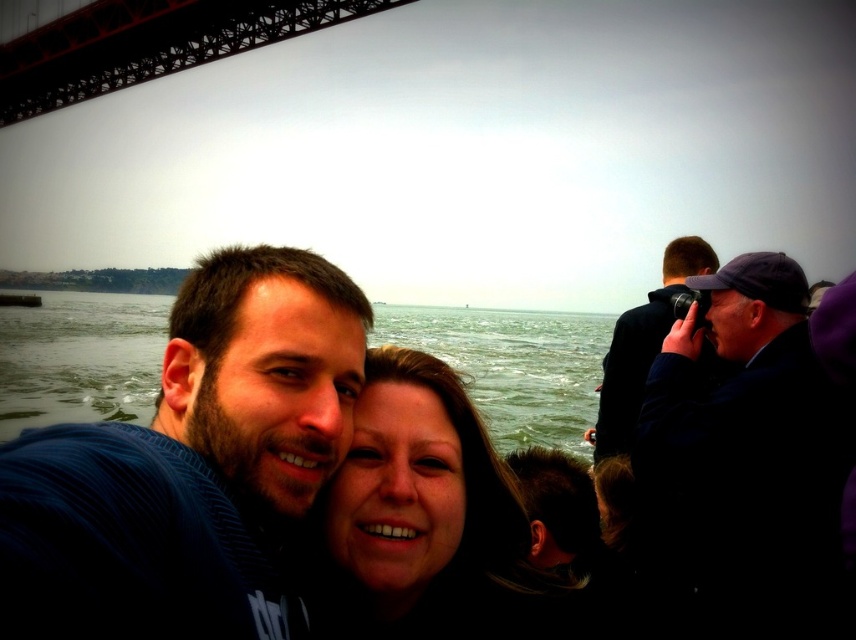
Question: Which is farther from the smooth skin face at center?

Choices:
 (A) green water at center
 (B) dark blue fabric at right
 (C) metallic bridge at upper left
 (D) dark blue striped shirt at center

Answer: (C)

Question: Can you confirm if green water at center is thinner than metallic bridge at upper left?

Choices:
 (A) yes
 (B) no

Answer: (B)

Question: From the image, what is the correct spatial relationship of dark blue striped shirt at center in relation to blue striped shirt at center?

Choices:
 (A) left
 (B) right

Answer: (B)

Question: Which point appears closest to the camera in this image?

Choices:
 (A) (345, 636)
 (B) (551, 369)
 (C) (37, 106)
 (D) (272, 444)

Answer: (D)

Question: Does smooth skin face at center appear on the left side of black fabric camera at right?

Choices:
 (A) yes
 (B) no

Answer: (A)

Question: Which point is closer to the camera taking this photo?

Choices:
 (A) [265, 29]
 (B) [749, 420]
 (C) [182, 288]
 (D) [669, 260]

Answer: (C)